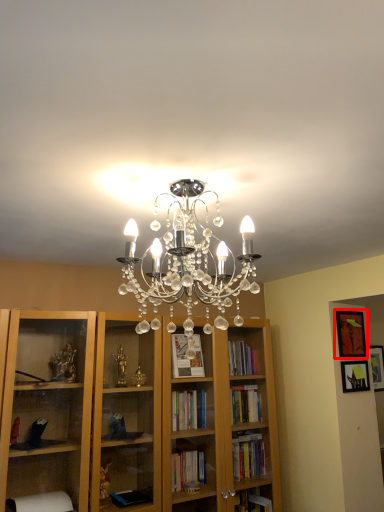
Question: Observing the image, what is the correct spatial positioning of picture frame (annotated by the red box) in reference to picture frame?

Choices:
 (A) right
 (B) left

Answer: (A)